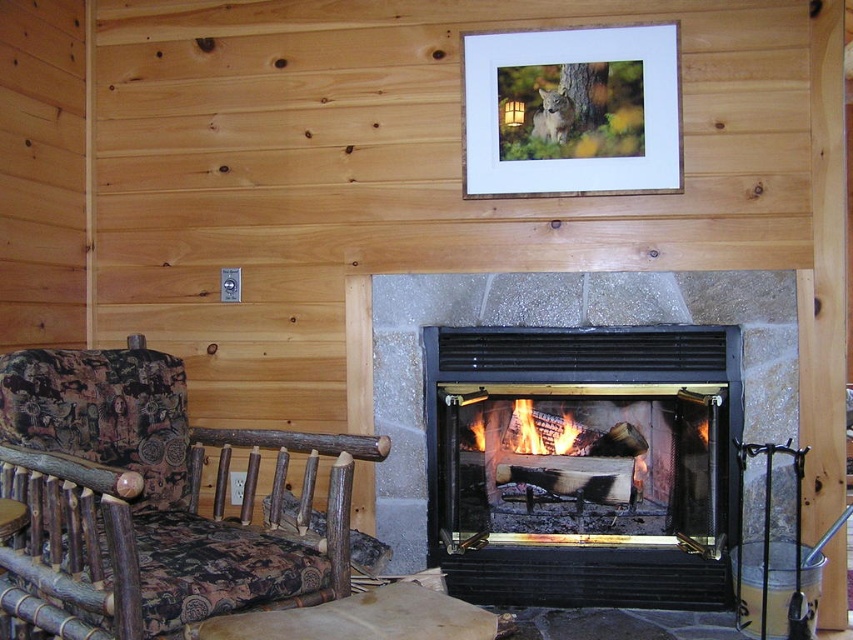
Question: Among these objects, which one is farthest from the camera?

Choices:
 (A) wooden-patterned fabric at left
 (B) wooden frame at upper center
 (C) black glass fireplace at center

Answer: (B)

Question: Can you confirm if wooden-patterned fabric at left is thinner than wooden frame at upper center?

Choices:
 (A) no
 (B) yes

Answer: (A)

Question: Considering the relative positions of wooden-patterned fabric at left and wooden frame at upper center in the image provided, where is wooden-patterned fabric at left located with respect to wooden frame at upper center?

Choices:
 (A) below
 (B) above

Answer: (A)

Question: Can you confirm if wooden-patterned fabric at left is thinner than charcoal wood fire at center?

Choices:
 (A) no
 (B) yes

Answer: (A)

Question: Based on their relative distances, which object is farther from the wooden-patterned fabric at left?

Choices:
 (A) black glass fireplace at center
 (B) wooden frame at upper center
 (C) charcoal wood fire at center

Answer: (B)

Question: Which of the following is the closest to the observer?

Choices:
 (A) 489,454
 (B) 515,438

Answer: (A)